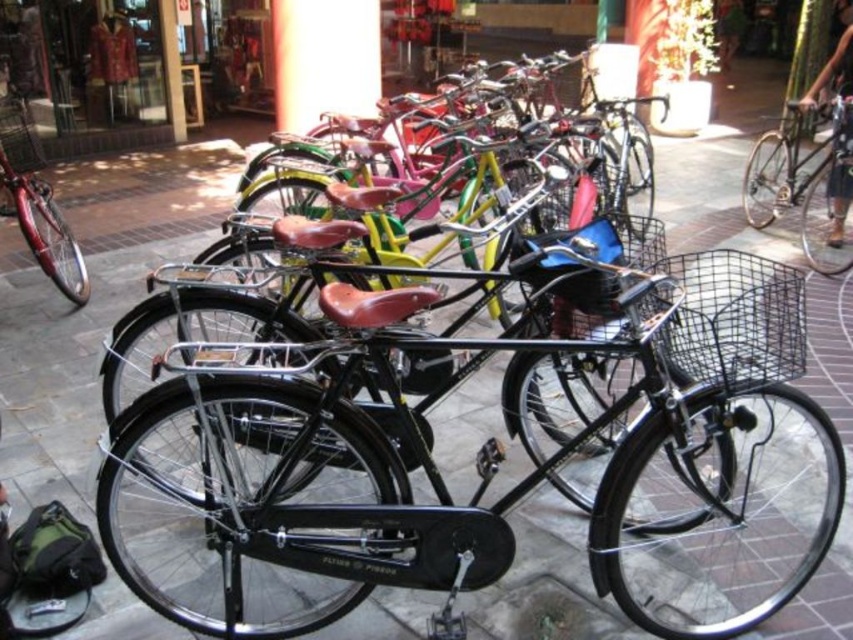
Does point (788, 180) come closer to viewer compared to point (10, 170)?

No, (788, 180) is further to viewer.

Can you confirm if shiny silver bicycle at right is wider than shiny red bicycle at left?

Yes, shiny silver bicycle at right is wider than shiny red bicycle at left.

This screenshot has height=640, width=853. Identify the location of shiny silver bicycle at right. (802, 184).